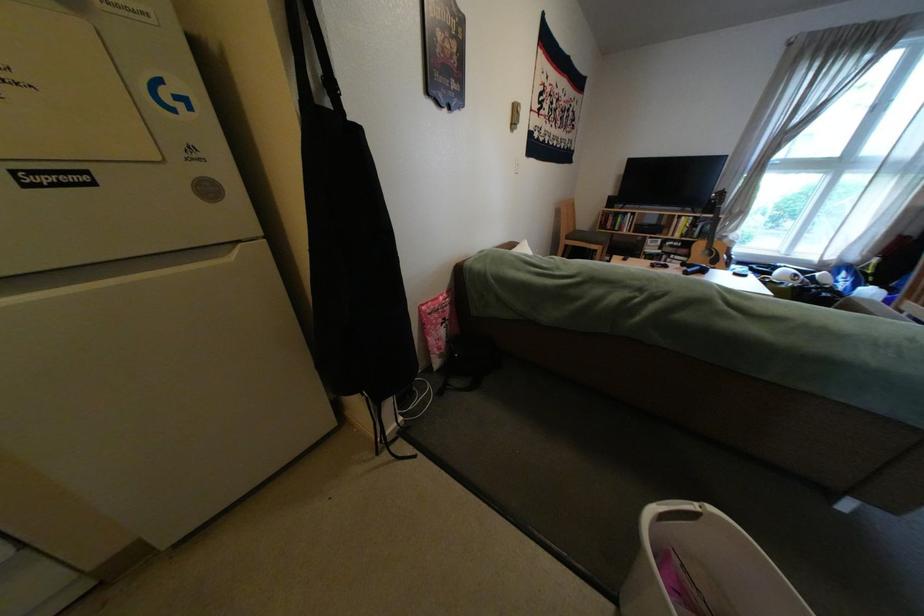
Where would you lift the white bin handle? Please return your answer as a coordinate pair (x, y).

(673, 512)